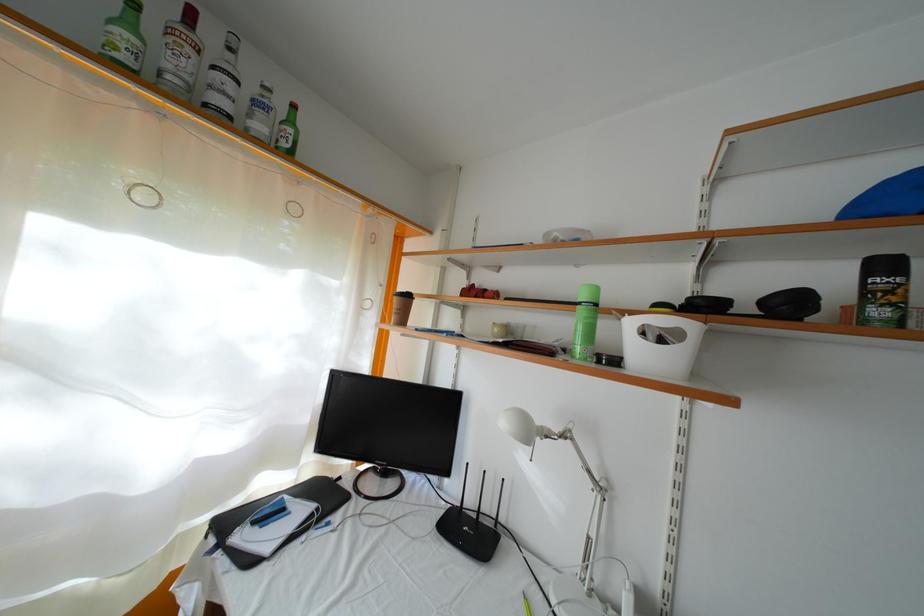
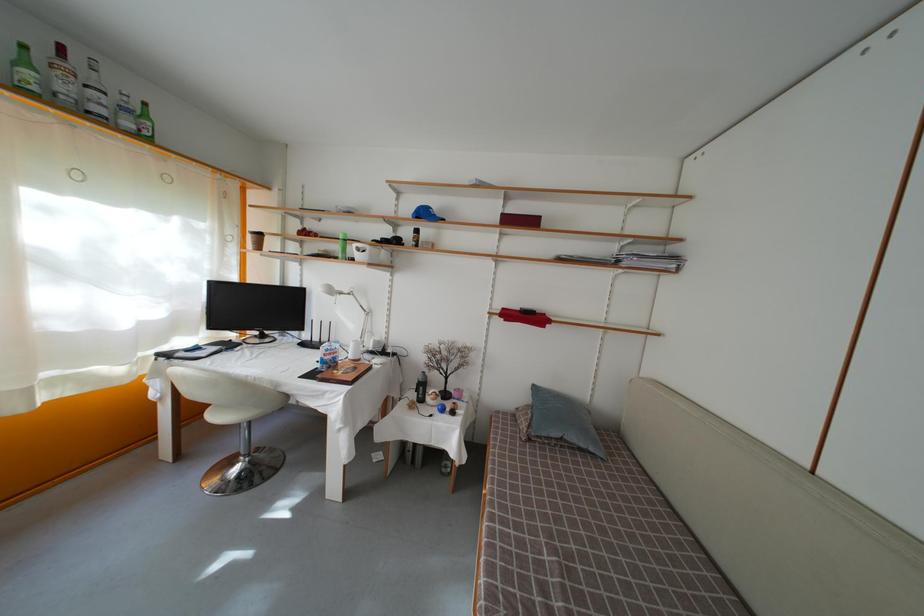
In the second image, find the point that corresponds to [134,31] in the first image.

(31, 69)